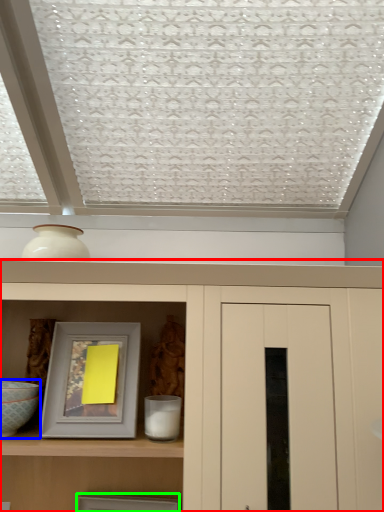
Question: Which is nearer to the cupboard (highlighted by a red box)? glass bowl (highlighted by a blue box) or picture frame (highlighted by a green box).

Choices:
 (A) glass bowl
 (B) picture frame

Answer: (A)